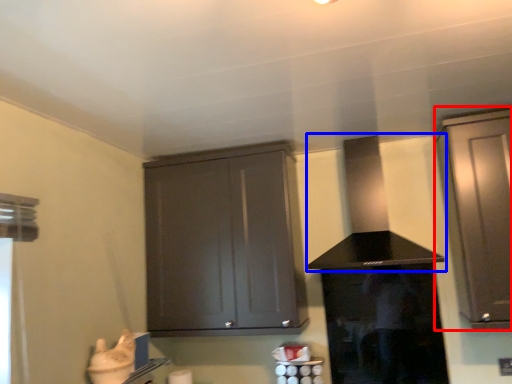
Question: Which object is further to the camera taking this photo, cabinetry (highlighted by a red box) or vent (highlighted by a blue box)?

Choices:
 (A) cabinetry
 (B) vent

Answer: (B)